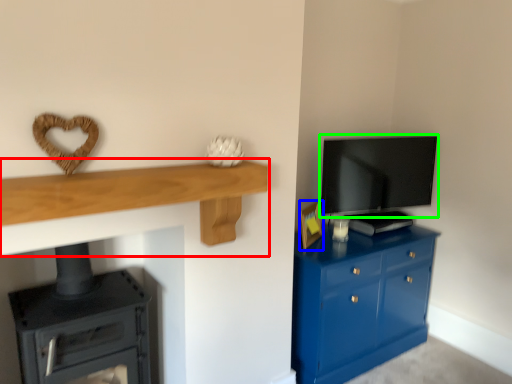
Question: Which object is positioned farthest from shelf (highlighted by a red box)? Select from picture frame (highlighted by a blue box) and television (highlighted by a green box).

Choices:
 (A) picture frame
 (B) television

Answer: (B)